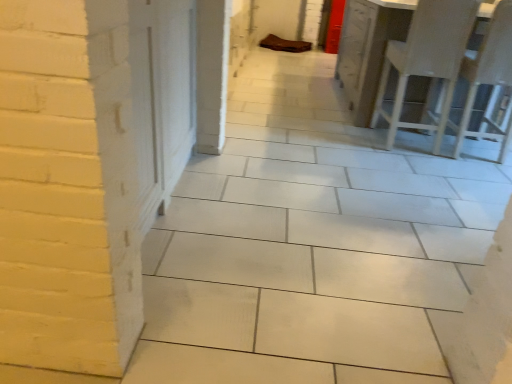
Measure the distance between white wood chairs at right and camera.

7.79 feet.

Describe the element at coordinates (449, 65) in the screenshot. The image size is (512, 384). I see `white wood chairs at right` at that location.

Find the location of a particular element. Image resolution: width=512 pixels, height=384 pixels. white wood chairs at right is located at coordinates (449, 65).

Identify the location of white plastic chair at right. (488, 76).

Image resolution: width=512 pixels, height=384 pixels. Describe the element at coordinates (488, 76) in the screenshot. I see `white plastic chair at right` at that location.

Identify the location of white wood chairs at right. (449, 65).

Which object is positioned more to the right, white wood chairs at right or white plastic chair at right?

From the viewer's perspective, white plastic chair at right appears more on the right side.

Between white wood chairs at right and white plastic chair at right, which one is positioned in front?

Positioned in front is white plastic chair at right.

Does point (442, 58) appear closer or farther from the camera than point (511, 23)?

Point (442, 58) is positioned farther from the camera compared to point (511, 23).

From the image's perspective, which is below, white wood chairs at right or white plastic chair at right?

white plastic chair at right appears lower in the image.

From a real-world perspective, who is located higher, white wood chairs at right or white plastic chair at right?

white plastic chair at right, from a real-world perspective.

Consider the image. Considering the relative sizes of white wood chairs at right and white plastic chair at right in the image provided, is white wood chairs at right wider than white plastic chair at right?

No.

Between white wood chairs at right and white plastic chair at right, which one has less height?

white wood chairs at right.

Considering the relative sizes of white wood chairs at right and white plastic chair at right in the image provided, is white wood chairs at right bigger than white plastic chair at right?

Yes.

Which is correct: white wood chairs at right is inside white plastic chair at right, or outside of it?

white wood chairs at right exists outside the volume of white plastic chair at right.

Looking at this image, is white wood chairs at right far away from white plastic chair at right?

Actually, white wood chairs at right and white plastic chair at right are a little close together.

Based on the photo, does white wood chairs at right turn towards white plastic chair at right?

No.

You are a GUI agent. You are given a task and a screenshot of the screen. Output one action in this format:
    pyautogui.click(x=<x>, y=<y>)
    Task: Click on the furniture behind the white plastic chair at right
    The height and width of the screenshot is (384, 512).
    Given the screenshot: What is the action you would take?
    pyautogui.click(x=449, y=65)

Is white plastic chair at right at the right side of white wood chairs at right?

Yes, white plastic chair at right is to the right of white wood chairs at right.

Is the position of white plastic chair at right less distant than that of white wood chairs at right?

Yes.

Is point (507, 28) more distant than point (496, 54)?

No, it is in front of (496, 54).

From the image's perspective, does white plastic chair at right appear lower than white wood chairs at right?

Correct, white plastic chair at right appears lower than white wood chairs at right in the image.

Consider the image. From a real-world perspective, which is physically below, white plastic chair at right or white wood chairs at right?

white wood chairs at right is physically lower.

Considering the sizes of objects white plastic chair at right and white wood chairs at right in the image provided, who is thinner, white plastic chair at right or white wood chairs at right?

white wood chairs at right is thinner.

Considering the relative sizes of white plastic chair at right and white wood chairs at right in the image provided, is white plastic chair at right taller than white wood chairs at right?

Yes, white plastic chair at right is taller than white wood chairs at right.

Considering the sizes of objects white plastic chair at right and white wood chairs at right in the image provided, who is bigger, white plastic chair at right or white wood chairs at right?

white wood chairs at right.

Choose the correct answer: Is white plastic chair at right inside white wood chairs at right or outside it?

white plastic chair at right is not enclosed by white wood chairs at right.

Based on the photo, is white plastic chair at right placed right next to white wood chairs at right?

white plastic chair at right and white wood chairs at right are not in contact.

Is white plastic chair at right oriented away from white wood chairs at right?

white plastic chair at right is not turned away from white wood chairs at right.

What's the angular difference between white plastic chair at right and white wood chairs at right's facing directions?

0.000723 degrees separate the facing orientations of white plastic chair at right and white wood chairs at right.

In the scene shown: How distant is white plastic chair at right from white wood chairs at right?

white plastic chair at right is 5.23 inches away from white wood chairs at right.

Find the location of a particular element. This screenshot has width=512, height=384. chair above the white wood chairs at right (from a real-world perspective) is located at coordinates (488, 76).

Locate an element on the screen. The height and width of the screenshot is (384, 512). chair above the white wood chairs at right (from a real-world perspective) is located at coordinates (488, 76).

You are a GUI agent. You are given a task and a screenshot of the screen. Output one action in this format:
    pyautogui.click(x=<x>, y=<y>)
    Task: Click on the furniture that is above the white plastic chair at right (from the image's perspective)
    The height and width of the screenshot is (384, 512).
    Given the screenshot: What is the action you would take?
    pyautogui.click(x=449, y=65)